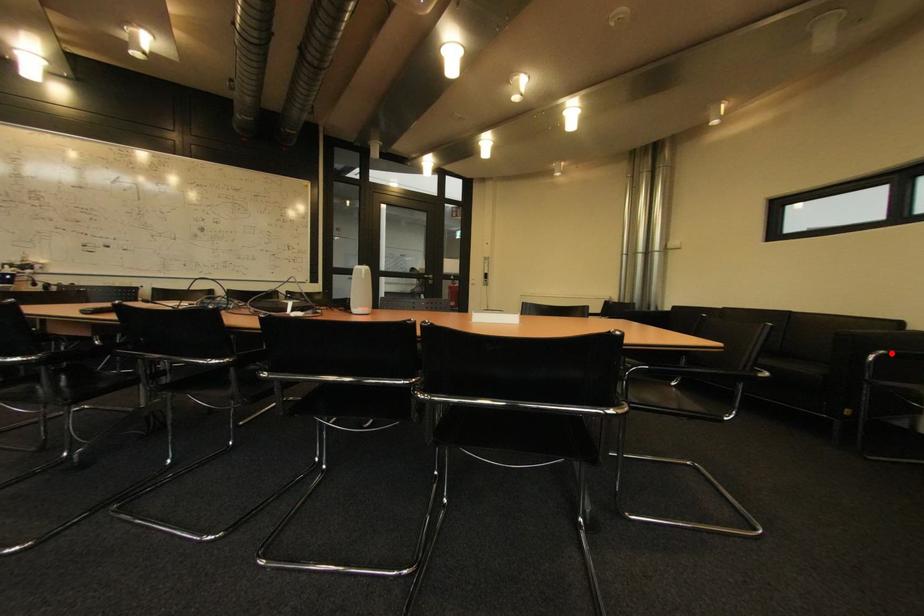
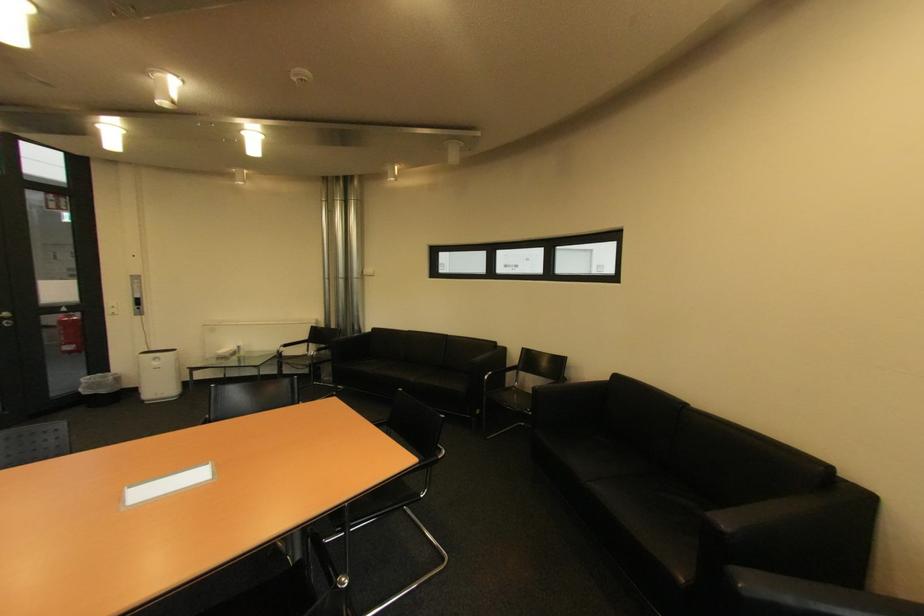
Question: A red point is marked in image1. In image2, is the corresponding 3D point closer to the camera or farther? Reply with the corresponding letter.

Choices:
 (A) The corresponding 3D point is closer.
 (B) The corresponding 3D point is farther.

Answer: (A)